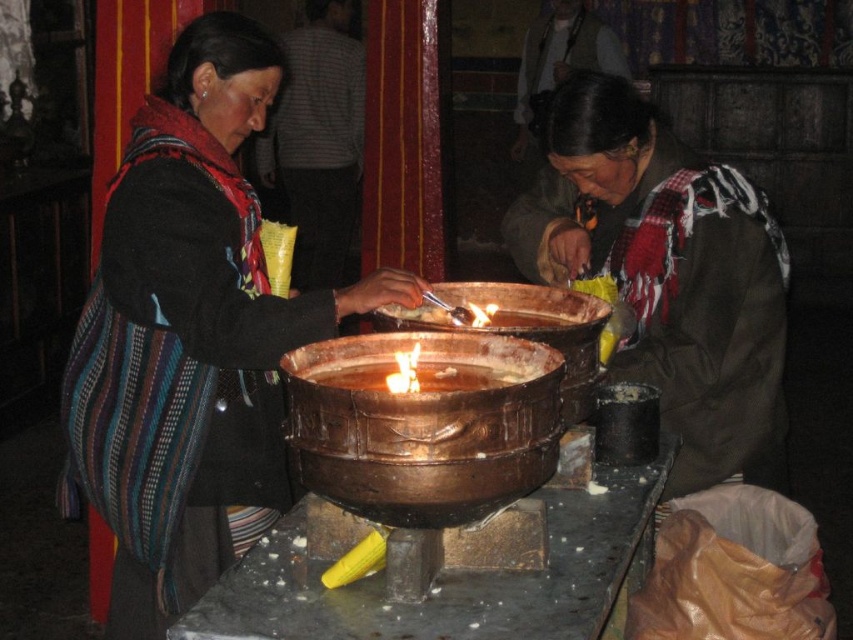
You are standing in the temple and want to reach the point marked at coordinates (x=135, y=252). If your arm can extend 5 feet, can you reach it without moving?

The point at coordinates (x=135, y=252) is 6.25 feet away from the viewer, which is farther than your arm can reach. You need to move closer to reach it.